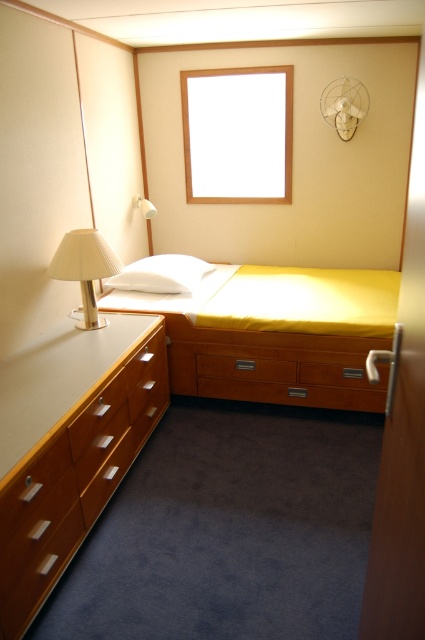
You are trying to move a large piece of luggage into the bedroom. The luggage is as wide as the transparent glass window at upper center. Will the yellow fabric bed at center fit through the doorway if you rotate it sideways?

The yellow fabric bed at center might be wider than the transparent glass window at upper center. If the bed is wider than the window, rotating it sideways might allow it to fit through the doorway, but there is uncertainty due to the possible width difference.

You are a delivery person who needs to place a small package on the bed. The package is 3 feet long. Can you safely place it diagonally on the yellow fabric bed at center without it hanging off the edge near the transparent glass window at upper center?

The distance between the yellow fabric bed at center and the transparent glass window at upper center is 3.32 feet. Since the package is 3 feet long, placing it diagonally would allow it to fit within the bed dimensions, as 3 feet is shorter than 3.32 feet. Therefore, it can be placed safely without hanging off the edge.